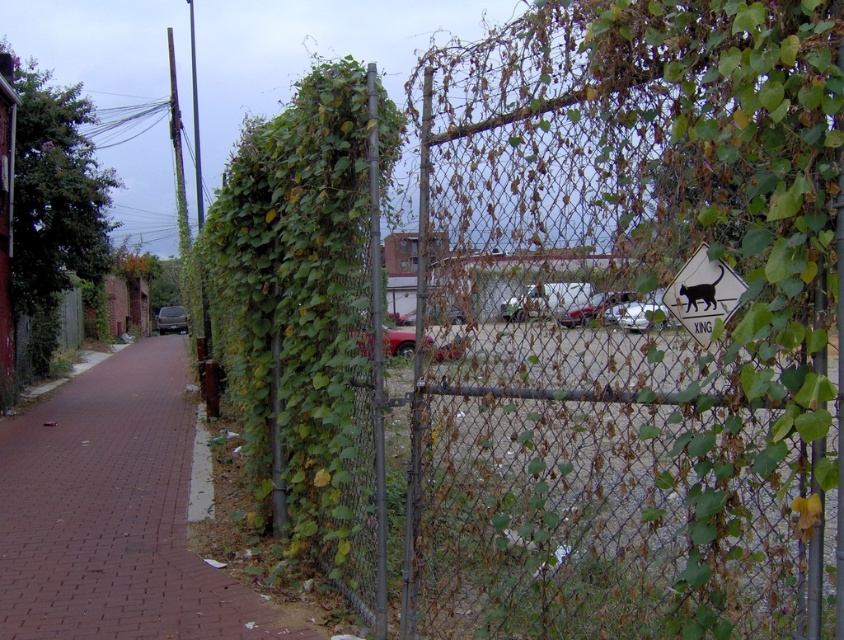
Question: Which object is the closest to the metallic silver car at center?

Choices:
 (A) shiny black sedan at center
 (B) white plastic sign at upper right

Answer: (B)

Question: Is metallic red car at center to the left of shiny black sedan at center from the viewer's perspective?

Choices:
 (A) yes
 (B) no

Answer: (B)

Question: Does white plastic sign at upper right have a greater width compared to shiny black sedan at center?

Choices:
 (A) yes
 (B) no

Answer: (B)

Question: Is white plastic sign at upper right further to camera compared to metallic silver car at center?

Choices:
 (A) yes
 (B) no

Answer: (B)

Question: Which point is closer to the camera taking this photo?

Choices:
 (A) (172, 360)
 (B) (705, 280)

Answer: (B)

Question: Which of the following is the closest to the observer?

Choices:
 (A) (572, 307)
 (B) (172, 308)

Answer: (A)